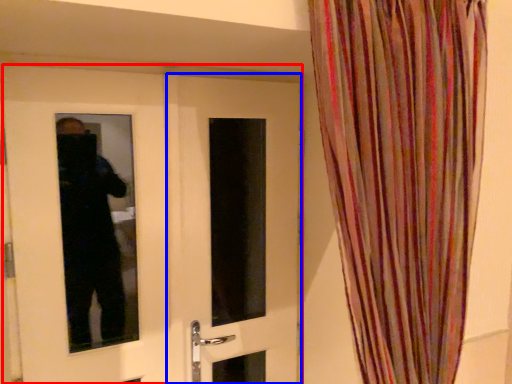
Question: Which point is closer to the camera, door (highlighted by a red box) or door (highlighted by a blue box)?

Choices:
 (A) door
 (B) door

Answer: (A)